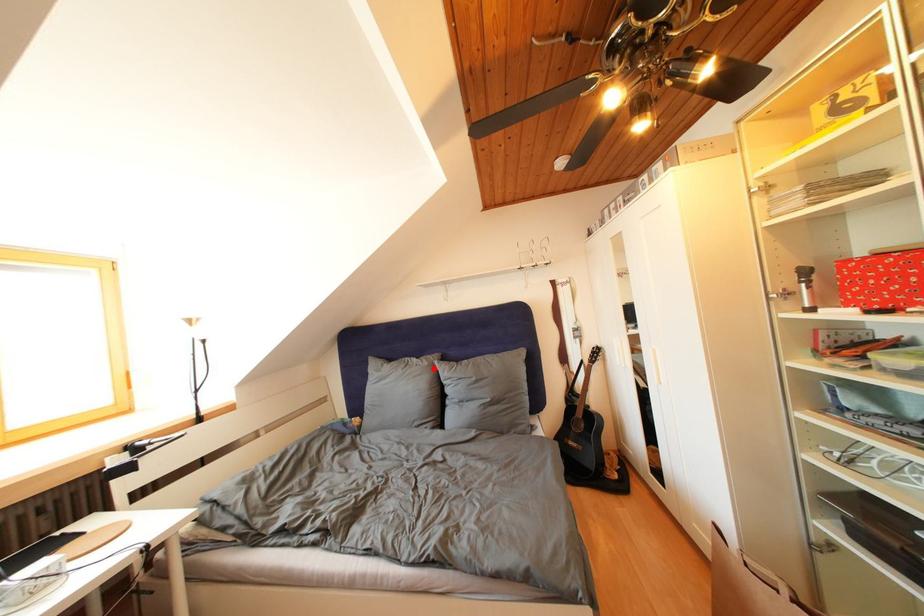
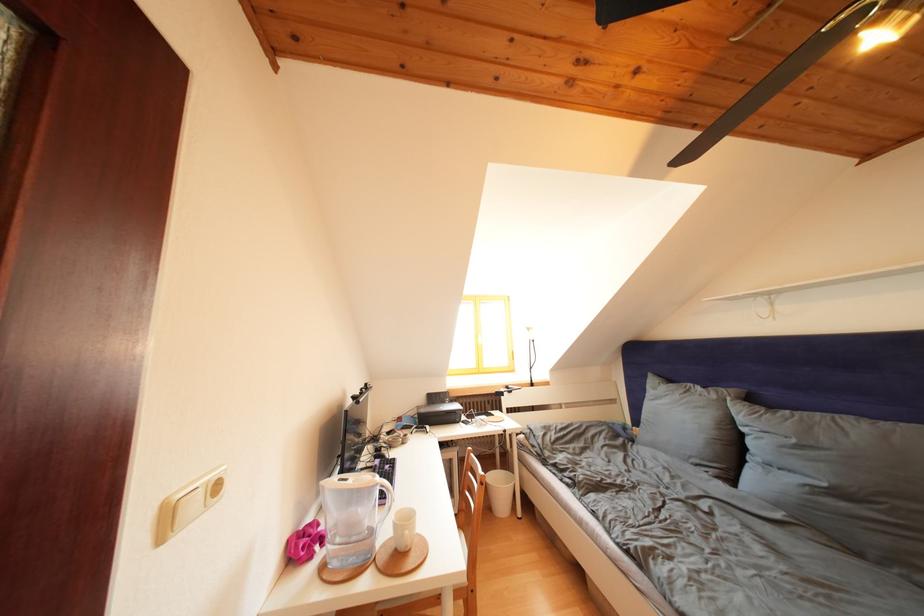
Locate, in the second image, the point that corresponds to the highlighted location in the first image.

(722, 402)